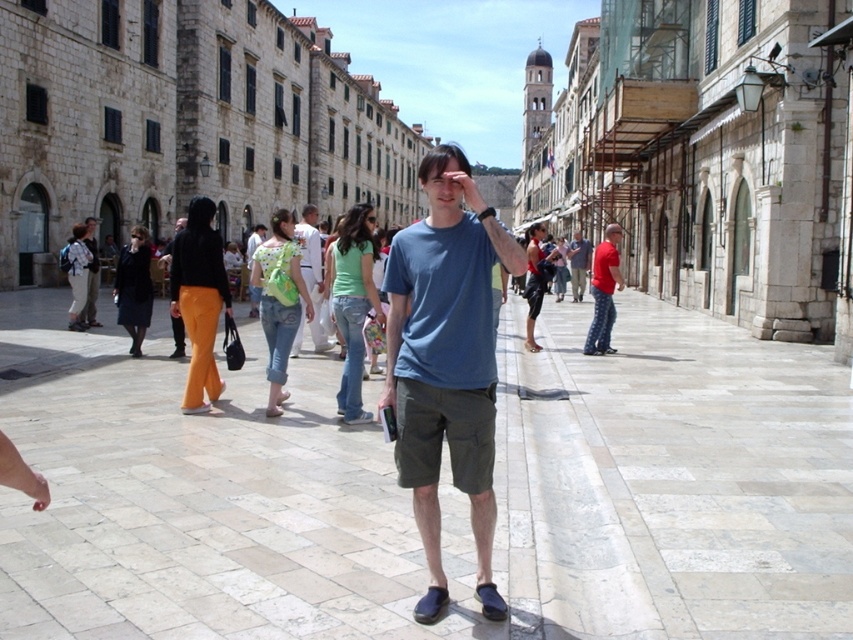
Question: Is light gray stone pavement at center behind red cotton shirt at right?

Choices:
 (A) no
 (B) yes

Answer: (A)

Question: Which point is farther to the camera?

Choices:
 (A) light gray stone pavement at center
 (B) matte green shirt at center
 (C) blue cotton t-shirt at center

Answer: (B)

Question: From the image, what is the correct spatial relationship of blue cotton t-shirt at center in relation to matte blue shirt at center?

Choices:
 (A) below
 (B) above

Answer: (A)

Question: Which of the following is the farthest from the observer?

Choices:
 (A) (296, 339)
 (B) (796, 616)
 (C) (86, 317)

Answer: (C)

Question: Among these objects, which one is nearest to the camera?

Choices:
 (A) matte green shirt at center
 (B) light gray stone pavement at center

Answer: (B)

Question: Can you confirm if blue cotton t-shirt at center is thinner than red cotton shirt at right?

Choices:
 (A) yes
 (B) no

Answer: (A)